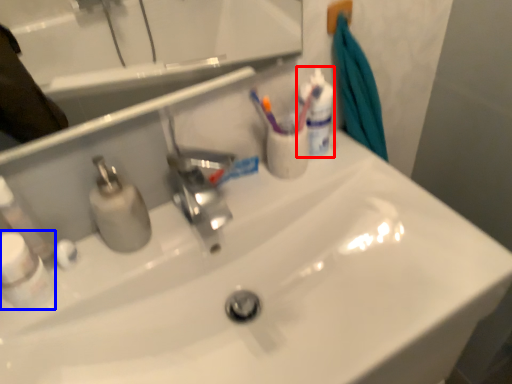
Question: Which object is further to the camera taking this photo, mouthwash (highlighted by a red box) or mouthwash (highlighted by a blue box)?

Choices:
 (A) mouthwash
 (B) mouthwash

Answer: (A)